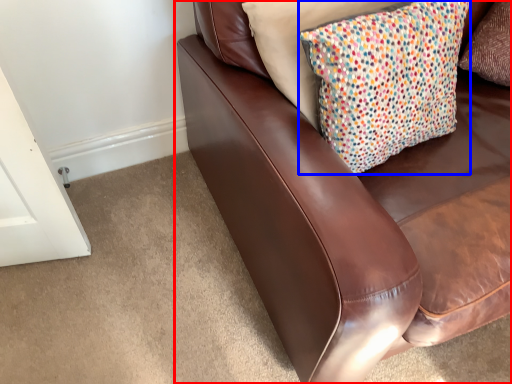
Question: Among these objects, which one is farthest to the camera, studio couch (highlighted by a red box) or pillow (highlighted by a blue box)?

Choices:
 (A) studio couch
 (B) pillow

Answer: (B)